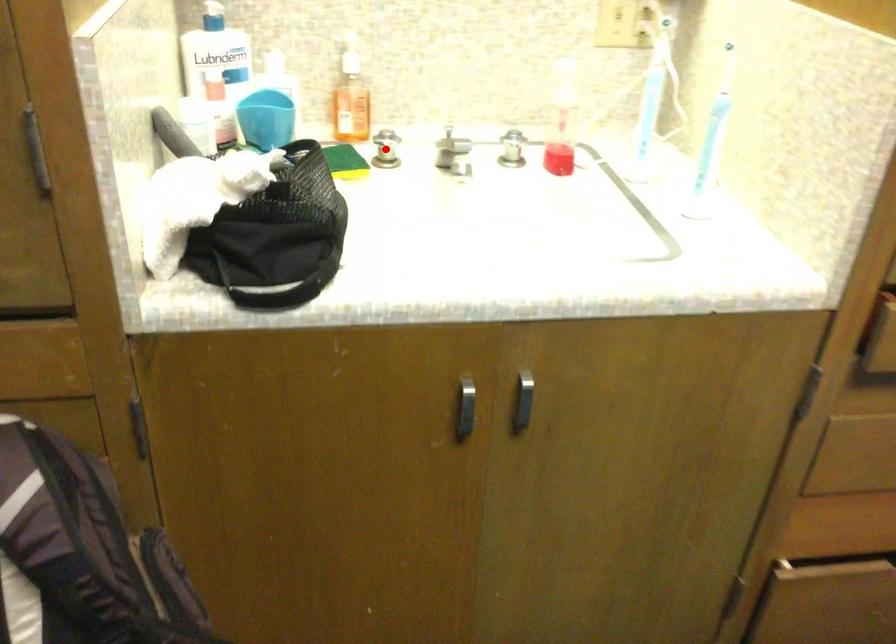
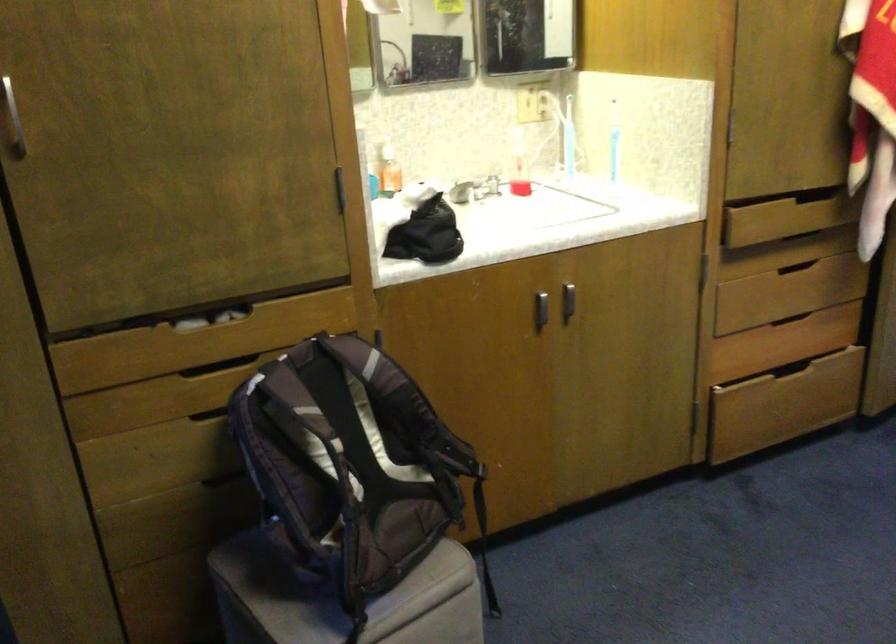
Question: I am providing you with two images of the same scene from different viewpoints. A red point is marked on the first image. Can you still see the location of the red point in image 2?

Choices:
 (A) Yes
 (B) No

Answer: (B)